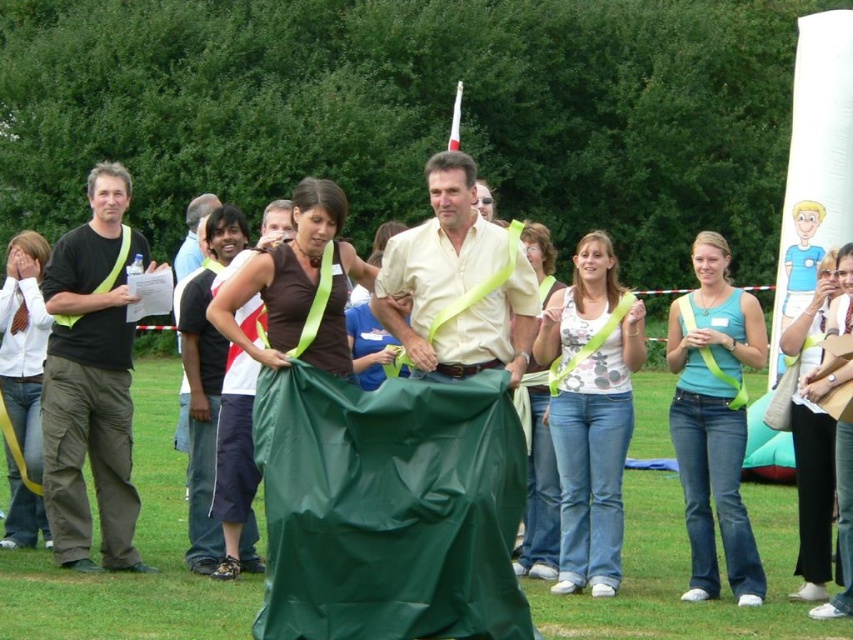
Is point (447, 160) positioned in front of point (194, 253)?

Yes, point (447, 160) is in front of point (194, 253).

Can you confirm if matte yellow shirt at center is positioned below matte black t-shirt at left?

No.

Between point (431, 166) and point (183, 408), which one is positioned behind?

Positioned behind is point (183, 408).

I want to click on matte yellow shirt at center, so click(457, 284).

Who is lower down, matte black shirt at left or matte yellow shirt at center?

matte black shirt at left is lower down.

Is matte black shirt at left behind matte yellow shirt at center?

Yes, matte black shirt at left is further from the viewer.

Locate an element on the screen. The image size is (853, 640). matte black shirt at left is located at coordinates (91, 380).

Where is `matte black shirt at left`? matte black shirt at left is located at coordinates (91, 380).

Between point (71, 282) and point (178, 436), which one is positioned in front?

Positioned in front is point (71, 282).

This screenshot has width=853, height=640. I want to click on matte black shirt at left, so click(x=91, y=380).